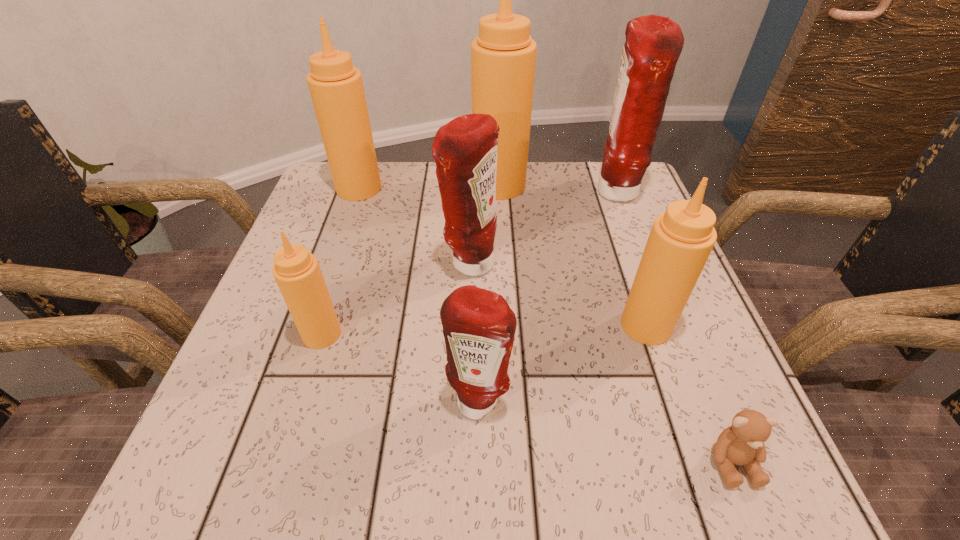
The height and width of the screenshot is (540, 960). I want to click on the nearest red condiment, so tap(479, 327).

Find the location of a particular element. the shortest object is located at coordinates (742, 443).

The width and height of the screenshot is (960, 540). In order to click on brown teddy bear in this screenshot , I will do `click(742, 443)`.

The image size is (960, 540). I want to click on free space located 0.350m on the left of the second tan condiment from right to left, so click(330, 185).

Identify the location of blank area located 0.360m on the front of the second biggest tan condiment. (314, 320).

You are a GUI agent. You are given a task and a screenshot of the screen. Output one action in this format:
    pyautogui.click(x=<x>, y=<y>)
    Task: Click on the vacant space located 0.060m on the back of the biggest red condiment
    The height and width of the screenshot is (540, 960).
    Given the screenshot: What is the action you would take?
    pyautogui.click(x=604, y=161)

Identify the location of free space located on the front of the second smallest red condiment. (468, 321).

The height and width of the screenshot is (540, 960). What are the coordinates of `blank area located on the back of the second smallest tan condiment` in the screenshot? It's located at (612, 225).

Identify the location of free region located 0.120m on the front of the smallest tan condiment. Image resolution: width=960 pixels, height=540 pixels. (296, 416).

Image resolution: width=960 pixels, height=540 pixels. I want to click on vacant space located 0.130m on the back of the nearest condiment, so click(479, 315).